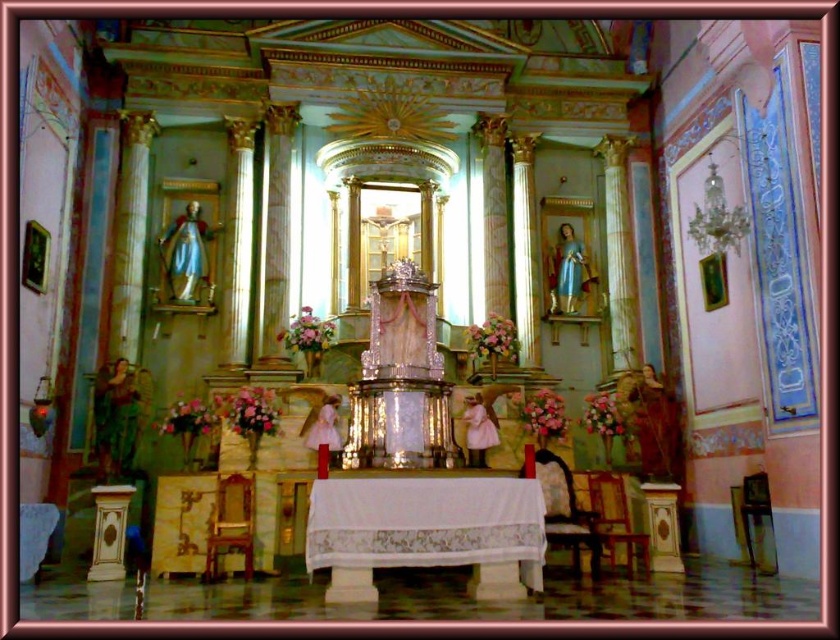
Does wooden chair at lower left come in front of wooden chair at center?

Yes, it is.

This screenshot has width=840, height=640. I want to click on wooden chair at lower left, so click(231, 524).

Who is positioned more to the right, wooden upholstered chair at center or wooden chair at center?

wooden chair at center

Is point (576, 532) in front of point (609, 524)?

Yes, it is.

The image size is (840, 640). In order to click on wooden upholstered chair at center in this screenshot , I will do `click(565, 509)`.

Looking at this image, can you confirm if white cloth-covered table at center is positioned to the right of wooden chair at center?

No, white cloth-covered table at center is not to the right of wooden chair at center.

Does white cloth-covered table at center have a lesser width compared to wooden chair at center?

Incorrect, white cloth-covered table at center's width is not less than wooden chair at center's.

Locate an element on the screen. white cloth-covered table at center is located at coordinates (426, 531).

The height and width of the screenshot is (640, 840). I want to click on white cloth-covered table at center, so click(x=426, y=531).